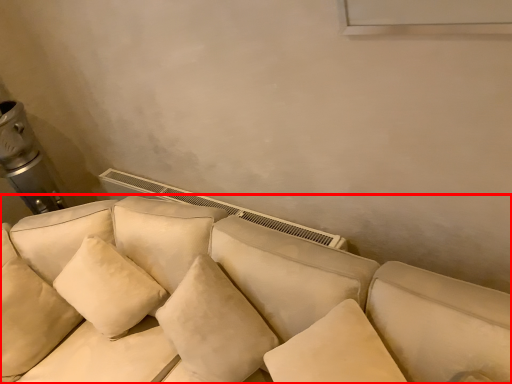
Question: Observing the image, what is the correct spatial positioning of studio couch (annotated by the red box) in reference to pillow?

Choices:
 (A) left
 (B) right

Answer: (B)